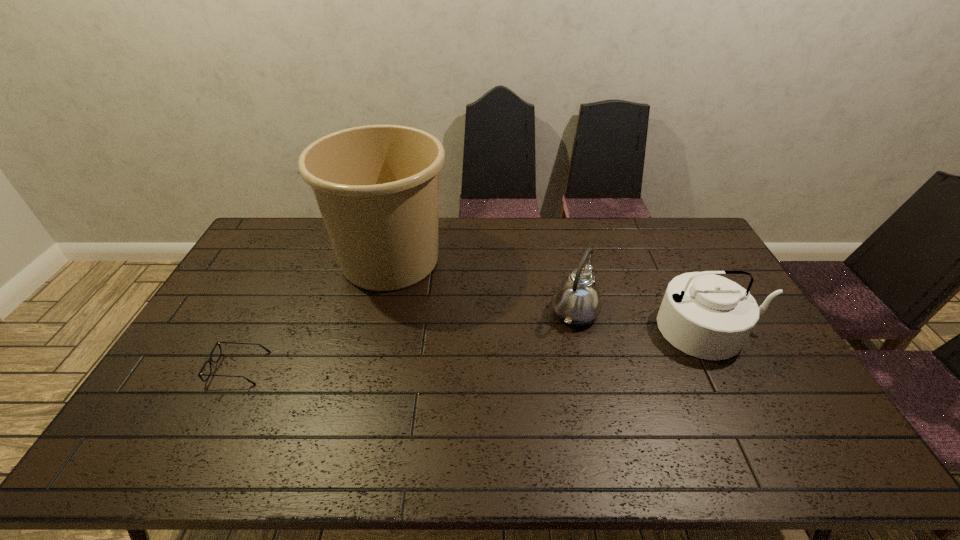
Identify the location of free space that is in between the right kettle and the left kettle. (642, 320).

Locate an element on the screen. The height and width of the screenshot is (540, 960). vacant region between the bucket and the right kettle is located at coordinates (549, 294).

The width and height of the screenshot is (960, 540). Identify the location of empty location between the second object from right to left and the right kettle. (642, 320).

At what (x,y) coordinates should I click in order to perform the action: click on vacant space that is in between the bucket and the rightmost object. Please return your answer as a coordinate pair (x, y). Looking at the image, I should click on (549, 294).

Locate an element on the screen. Image resolution: width=960 pixels, height=540 pixels. vacant space in between the right kettle and the leftmost object is located at coordinates (474, 348).

Find the location of `blank region between the spectacles and the third object from right to left`. blank region between the spectacles and the third object from right to left is located at coordinates (314, 314).

This screenshot has height=540, width=960. I want to click on blank region between the third object from left to right and the bucket, so click(482, 286).

Locate an element on the screen. free spot between the third object from left to right and the tallest object is located at coordinates (482, 286).

Where is `vacant area between the right kettle and the second object from left to right`? This screenshot has width=960, height=540. vacant area between the right kettle and the second object from left to right is located at coordinates (549, 294).

Locate an element on the screen. object that is the third closest to the left kettle is located at coordinates (210, 360).